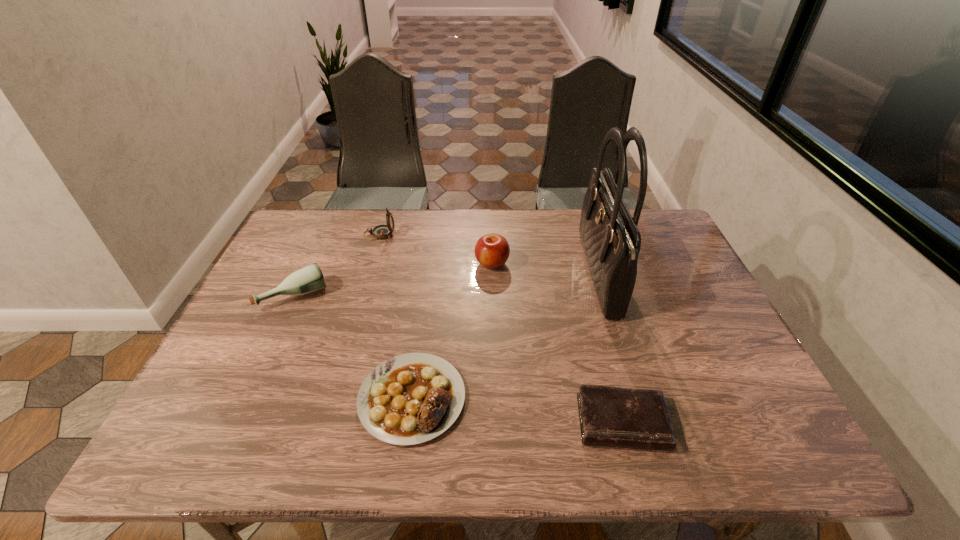
Where is `vacant point located 0.160m with an open clasp on the front of the tallest object`? Image resolution: width=960 pixels, height=540 pixels. vacant point located 0.160m with an open clasp on the front of the tallest object is located at coordinates (530, 275).

The width and height of the screenshot is (960, 540). Find the location of `free space located on the face of the compass`. free space located on the face of the compass is located at coordinates (510, 234).

Find the location of a particular element. This screenshot has height=540, width=960. free space located 0.390m on the right of the third object from right to left is located at coordinates (640, 264).

I want to click on free region located on the front of the bottle, so click(x=268, y=353).

At what (x,y) coordinates should I click in order to perform the action: click on free space located on the right of the steak. Please return your answer as a coordinate pair (x, y). Looking at the image, I should click on (644, 398).

You are a GUI agent. You are given a task and a screenshot of the screen. Output one action in this format:
    pyautogui.click(x=<x>, y=<y>)
    Task: Click on the free region located 0.190m on the left of the shortest object
    
    Given the screenshot: What is the action you would take?
    pyautogui.click(x=486, y=422)

Find the location of a particular element. Image resolution: width=960 pixels, height=540 pixels. handbag located in the far edge section of the desktop is located at coordinates (x=611, y=239).

Locate an element on the screen. This screenshot has height=540, width=960. compass at the far edge is located at coordinates (381, 231).

Where is `apple that is at the far edge`? apple that is at the far edge is located at coordinates 492,250.

Identify the location of steak present at the near edge. The width and height of the screenshot is (960, 540). (409, 399).